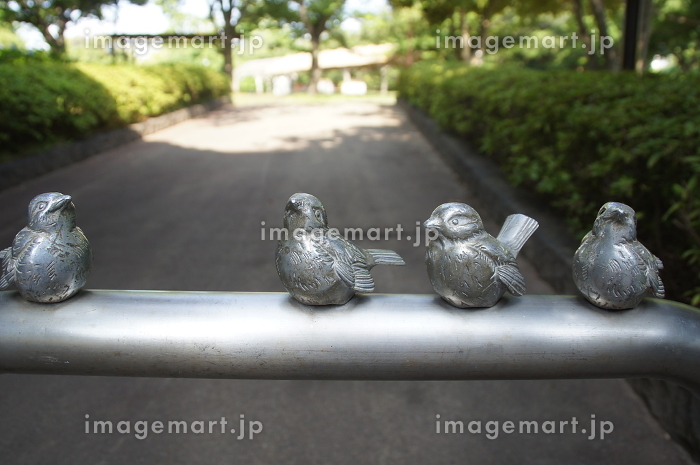
You are a GUI agent. You are given a task and a screenshot of the screen. Output one action in this format:
    pyautogui.click(x=<x>, y=<y>)
    Task: Click on the bar
    
    Given the screenshot: What is the action you would take?
    pyautogui.click(x=309, y=348)